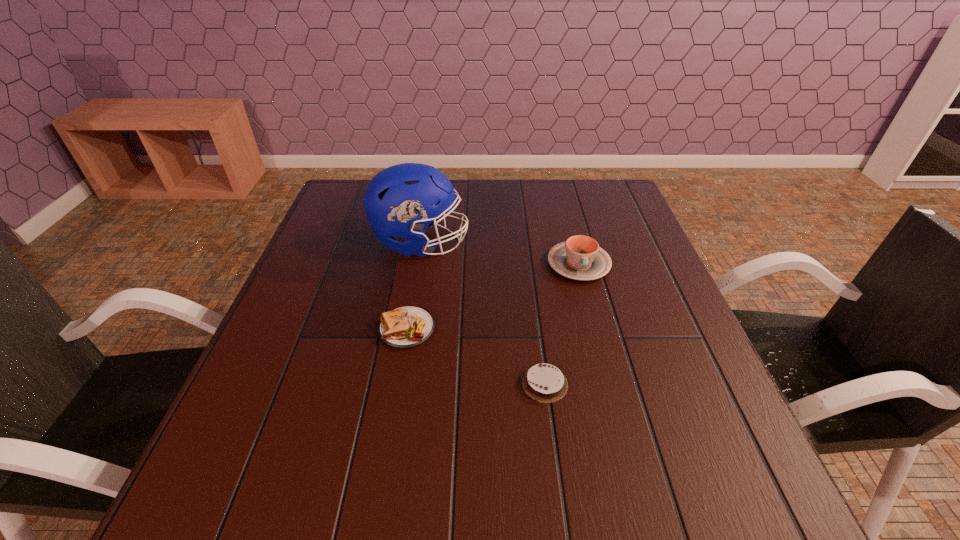
The image size is (960, 540). Identify the location of the tallest object. (399, 201).

Where is `the third shortest object`? The width and height of the screenshot is (960, 540). the third shortest object is located at coordinates pos(580,258).

The height and width of the screenshot is (540, 960). What are the coordinates of `chinaware` in the screenshot? It's located at (580, 258).

Identify the location of sandwich. (406, 327).

This screenshot has height=540, width=960. I want to click on the second shortest object, so click(x=406, y=327).

I want to click on chocolate cake, so click(543, 382).

Identify the location of the second object from right to left. The width and height of the screenshot is (960, 540). (543, 382).

Find the location of `vacant area situated 0.390m on the front-facing side of the football helmet`. vacant area situated 0.390m on the front-facing side of the football helmet is located at coordinates [612, 242].

Find the location of a particular element. The width and height of the screenshot is (960, 540). free space located on the handle side of the second tallest object is located at coordinates (616, 406).

What are the coordinates of `vacant point located 0.150m on the back of the sandwich` in the screenshot? It's located at (418, 267).